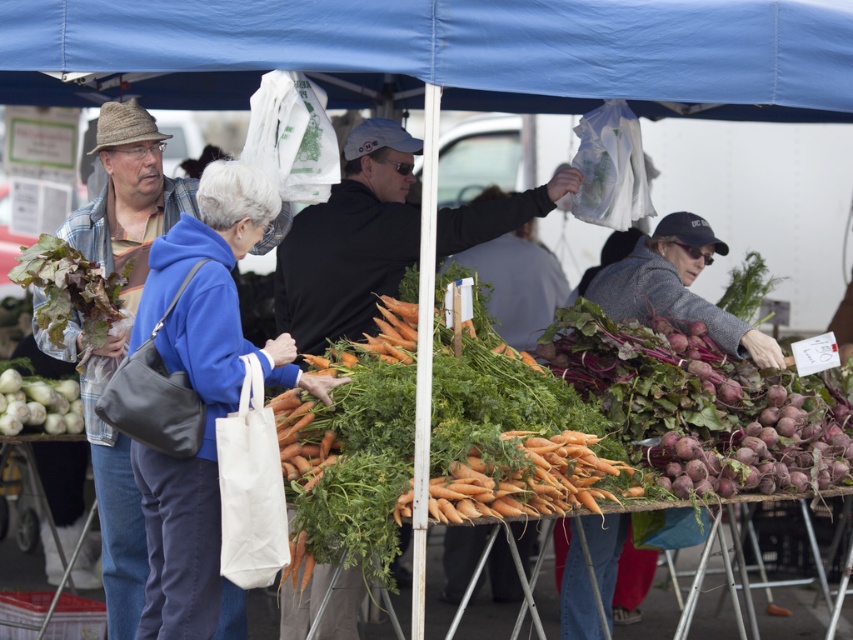
Does blue fabric canopy at upper center have a smaller size compared to plaid flannel shirt at left?

Actually, blue fabric canopy at upper center might be larger than plaid flannel shirt at left.

Can you confirm if blue fabric canopy at upper center is positioned to the left of plaid flannel shirt at left?

No, blue fabric canopy at upper center is not to the left of plaid flannel shirt at left.

Locate an element on the screen. The image size is (853, 640). blue fabric canopy at upper center is located at coordinates (440, 52).

Where is `blue fabric canopy at upper center`? blue fabric canopy at upper center is located at coordinates (440, 52).

Can you confirm if orange matte carrots at center is thinner than dark green leafy vegetable at left?

In fact, orange matte carrots at center might be wider than dark green leafy vegetable at left.

Does point (527, 509) lie in front of point (78, 252)?

Yes, it is in front of point (78, 252).

Where is `orange matte carrots at center`? This screenshot has height=640, width=853. orange matte carrots at center is located at coordinates (526, 481).

Is plaid flannel shirt at left above white matte fennel at lower left?

Yes, plaid flannel shirt at left is above white matte fennel at lower left.

Is point (138, 564) positioned in front of point (35, 401)?

Yes, it is.

You are a GUI agent. You are given a task and a screenshot of the screen. Output one action in this format:
    pyautogui.click(x=<x>, y=<y>)
    Task: Click on the plaid flannel shirt at left
    The image size is (853, 640).
    Given the screenshot: What is the action you would take?
    pyautogui.click(x=128, y=196)